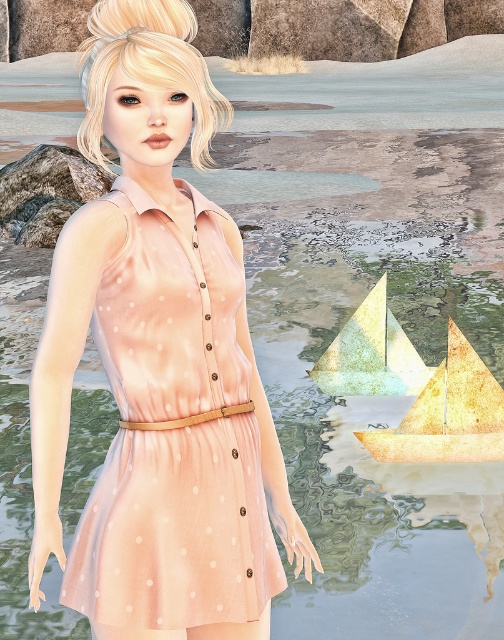
You are an AI analyzing the positioning of the peach satin dress at center in the image. What are the coordinates of its 2D location?

The 2D location of the peach satin dress at center is at point (x=175, y=531).

You are a photographer planning to capture the scene with the peach satin dress at center and the gold textured sailboat at lower right. Since you want both objects to appear similar in size in the photo, which object should you move closer to the camera?

The peach satin dress at center is smaller than the gold textured sailboat at lower right, so you should move the peach satin dress at center closer to the camera to make it appear larger in the photo and balance the sizes.